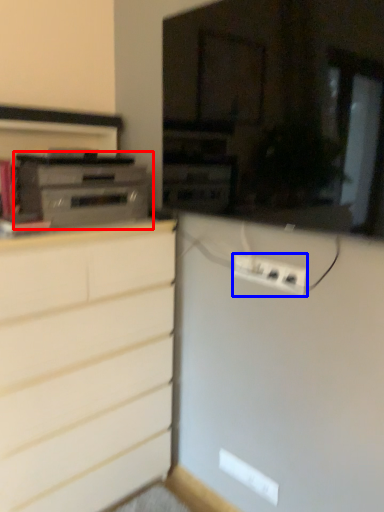
Question: Among these objects, which one is nearest to the camera, home appliance (highlighted by a red box) or electric outlet (highlighted by a blue box)?

Choices:
 (A) home appliance
 (B) electric outlet

Answer: (B)